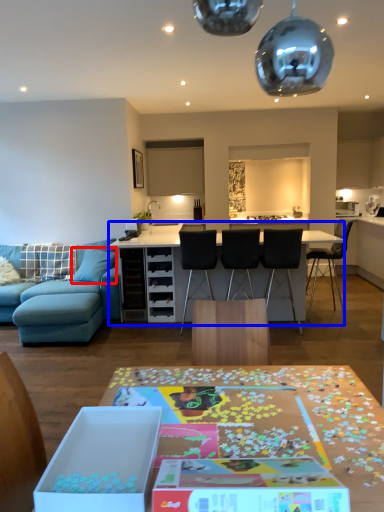
Question: Which point is further to the camera, pillow (highlighted by a red box) or table (highlighted by a blue box)?

Choices:
 (A) pillow
 (B) table

Answer: (A)